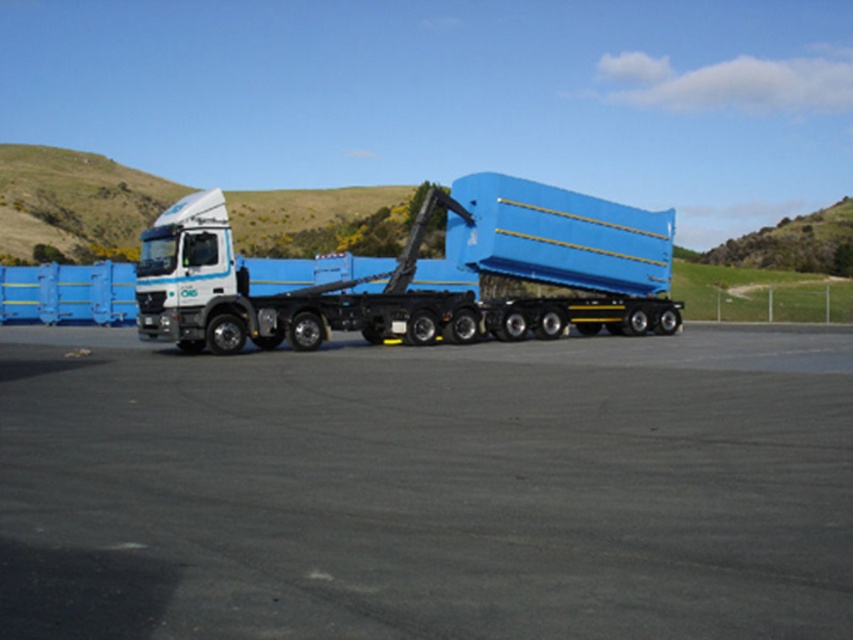
Question: Which point is closer to the camera taking this photo?

Choices:
 (A) (497, 209)
 (B) (403, 381)

Answer: (B)

Question: Is black asphalt at center closer to camera compared to matte blue truck at center?

Choices:
 (A) yes
 (B) no

Answer: (A)

Question: Among these objects, which one is nearest to the camera?

Choices:
 (A) matte blue truck at center
 (B) black asphalt at center

Answer: (B)

Question: Does black asphalt at center lie in front of matte blue truck at center?

Choices:
 (A) no
 (B) yes

Answer: (B)

Question: Does black asphalt at center appear over matte blue truck at center?

Choices:
 (A) yes
 (B) no

Answer: (B)